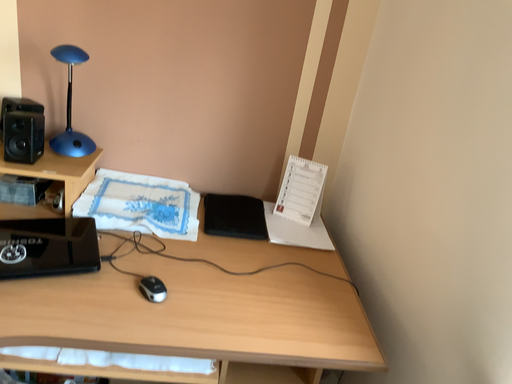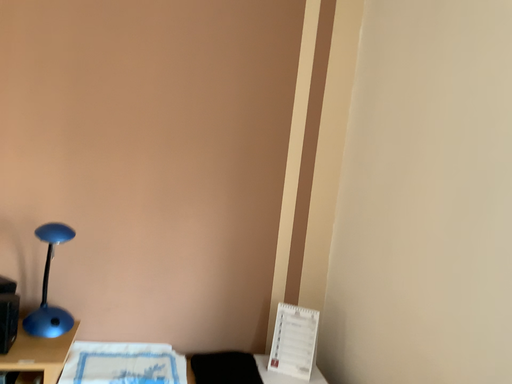
Question: Which way did the camera rotate in the video?

Choices:
 (A) rotated right
 (B) rotated left

Answer: (A)